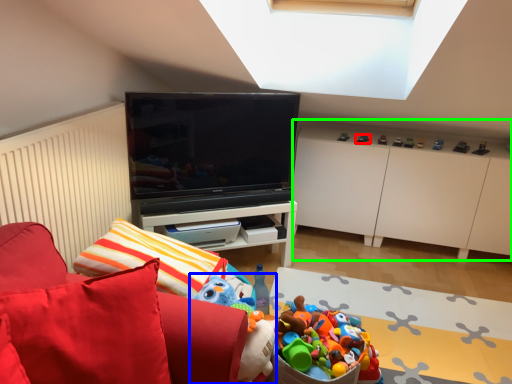
Question: Considering the real-world distances, which object is farthest from toy (highlighted by a red box)? toy (highlighted by a blue box) or cabinetry (highlighted by a green box)?

Choices:
 (A) toy
 (B) cabinetry

Answer: (A)